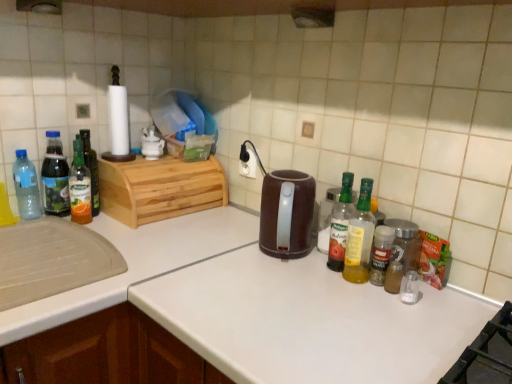
Question: Is translucent glass spice jar at center-right, which is counted as the seventh bottle, starting from the left, facing towards clear glass spice jar at right, marked as the eighth bottle in a left-to-right arrangement?

Choices:
 (A) no
 (B) yes

Answer: (A)

Question: Does translucent glass spice jar at center-right, the second bottle viewed from the right, have a lesser width compared to clear glass spice jar at right, positioned as the first bottle in right-to-left order?

Choices:
 (A) no
 (B) yes

Answer: (B)

Question: Is translucent glass spice jar at center-right, which is counted as the seventh bottle, starting from the left, not close to clear glass spice jar at right, positioned as the first bottle in right-to-left order?

Choices:
 (A) no
 (B) yes

Answer: (A)

Question: From a real-world perspective, is translucent glass spice jar at center-right, the second bottle viewed from the right, located beneath clear glass spice jar at right, positioned as the first bottle in right-to-left order?

Choices:
 (A) yes
 (B) no

Answer: (B)

Question: Considering the relative sizes of translucent glass spice jar at center-right, the second bottle viewed from the right, and clear glass spice jar at right, positioned as the first bottle in right-to-left order, in the image provided, is translucent glass spice jar at center-right, the second bottle viewed from the right, wider than clear glass spice jar at right, positioned as the first bottle in right-to-left order,?

Choices:
 (A) no
 (B) yes

Answer: (A)

Question: Does translucent glass spice jar at center-right, which is counted as the seventh bottle, starting from the left, lie in front of clear glass spice jar at right, marked as the eighth bottle in a left-to-right arrangement?

Choices:
 (A) no
 (B) yes

Answer: (B)

Question: From the image's perspective, does translucent glass bottle at left, arranged as the 6th bottle when viewed from the right, appear lower than transparent plastic bottle at left, the eighth bottle viewed from the right?

Choices:
 (A) yes
 (B) no

Answer: (B)

Question: From the image's perspective, is translucent glass bottle at left, arranged as the third bottle when viewed from the left, on transparent plastic bottle at left, the eighth bottle viewed from the right?

Choices:
 (A) yes
 (B) no

Answer: (A)

Question: Can you confirm if translucent glass bottle at left, arranged as the third bottle when viewed from the left, is bigger than transparent plastic bottle at left, which is the first bottle from left to right?

Choices:
 (A) yes
 (B) no

Answer: (A)

Question: Is translucent glass bottle at left, arranged as the 6th bottle when viewed from the right, aimed at transparent plastic bottle at left, the eighth bottle viewed from the right?

Choices:
 (A) yes
 (B) no

Answer: (B)

Question: Is transparent plastic bottle at left, the eighth bottle viewed from the right, inside translucent glass bottle at left, arranged as the third bottle when viewed from the left?

Choices:
 (A) yes
 (B) no

Answer: (B)

Question: Is translucent glass bottle at left, arranged as the 6th bottle when viewed from the right, wider than transparent plastic bottle at left, the eighth bottle viewed from the right?

Choices:
 (A) no
 (B) yes

Answer: (A)

Question: Is translucent glass bottle at left, marked as the 7th bottle in a right-to-left arrangement, oriented towards clear glass spice jar at right, positioned as the first bottle in right-to-left order?

Choices:
 (A) no
 (B) yes

Answer: (A)